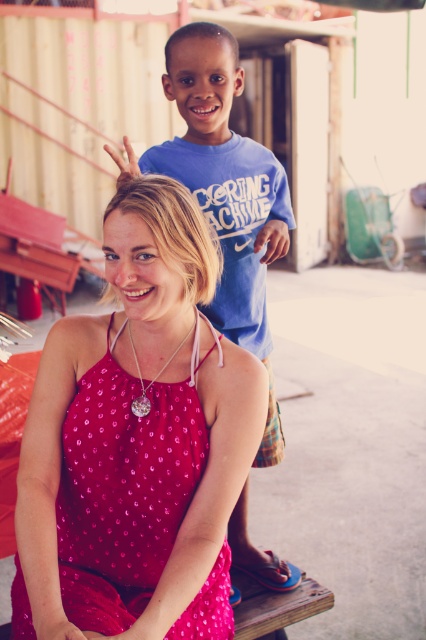
Which is in front, point (169, 541) or point (138, 397)?

Point (138, 397) is in front.

Consider the image. Is shiny red dress at center behind silver metallic pendant at center?

No.

Between point (91, 621) and point (134, 355), which one is positioned behind?

The point (134, 355) is behind.

Where is `shiny red dress at center`? Image resolution: width=426 pixels, height=640 pixels. shiny red dress at center is located at coordinates (123, 492).

Does shiny red dress at center come behind blue cotton shirt at upper center?

That is False.

Between point (83, 499) and point (241, 189), which one is positioned in front?

Positioned in front is point (83, 499).

At what (x,y) coordinates should I click in order to perform the action: click on shiny red dress at center. Please return your answer as a coordinate pair (x, y). This screenshot has width=426, height=640. Looking at the image, I should click on (123, 492).

Between point (276, 230) and point (196, 356), which one is positioned in front?

Point (196, 356) is more forward.

Does blue cotton shirt at upper center appear on the left side of silver metallic pendant at center?

Incorrect, blue cotton shirt at upper center is not on the left side of silver metallic pendant at center.

Is point (236, 560) closer to viewer compared to point (146, 404)?

No, (236, 560) is further to viewer.

The image size is (426, 640). What are the coordinates of `blue cotton shirt at upper center` in the screenshot? It's located at (224, 192).